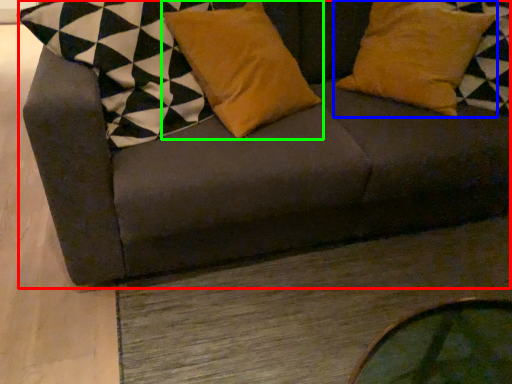
Question: Based on their relative distances, which object is nearer to studio couch (highlighted by a red box)? Choose from pillow (highlighted by a blue box) and pillow (highlighted by a green box).

Choices:
 (A) pillow
 (B) pillow

Answer: (B)